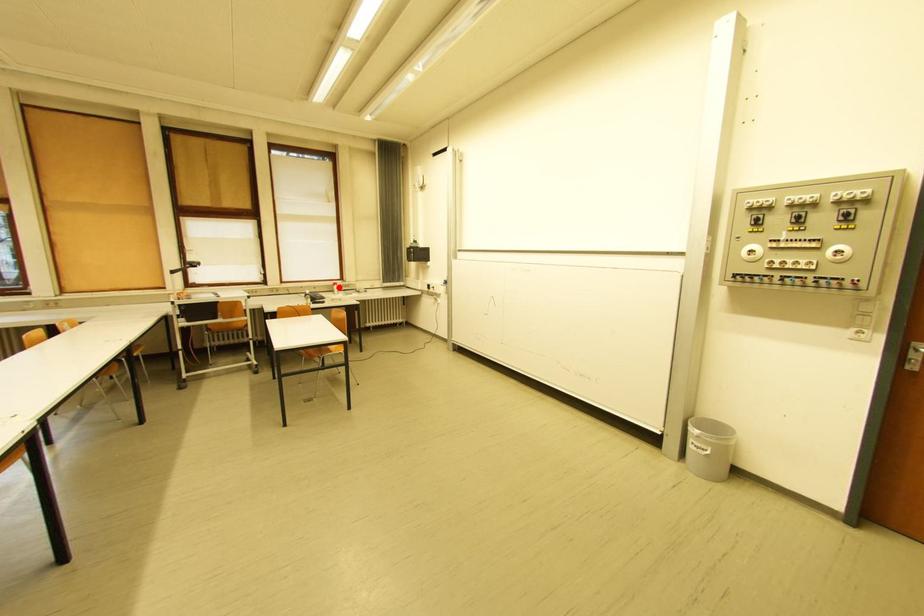
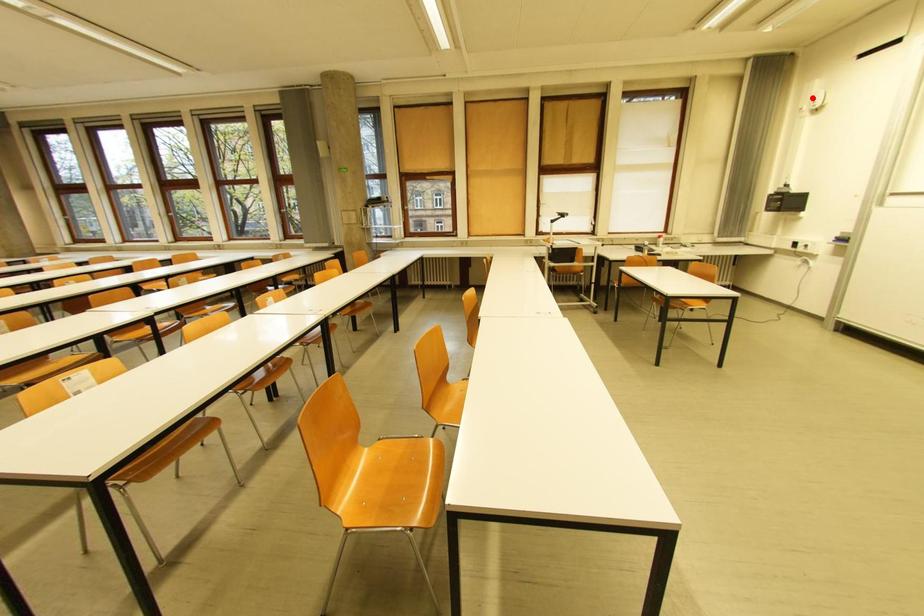
I am providing you with two images of the same scene from different viewpoints. A red point is marked on the first image and another point is marked on the second image. Does the point marked in image1 correspond to the same location as the one in image2?

No